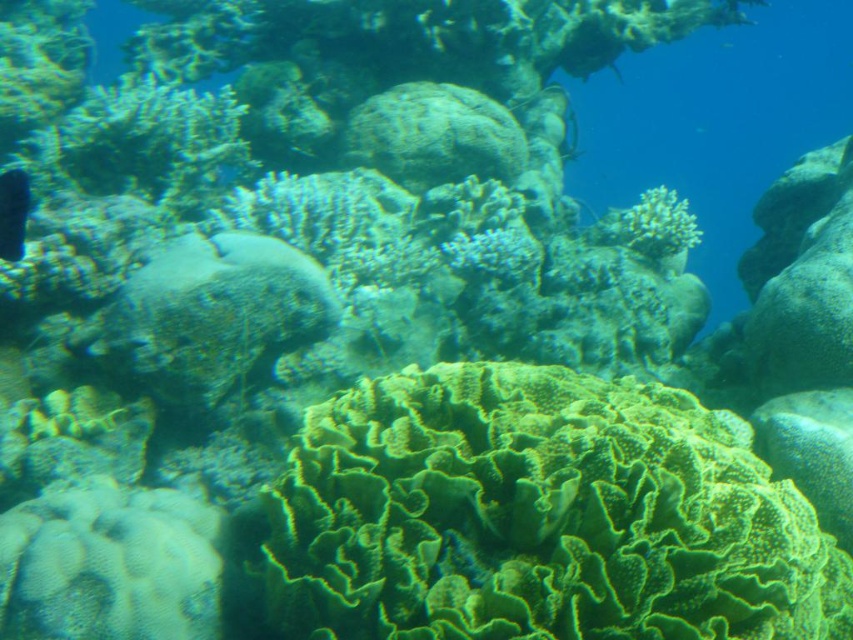
Can you confirm if green textured coral at center is positioned to the right of shiny black fish at left?

Correct, you'll find green textured coral at center to the right of shiny black fish at left.

Between green textured coral at center and shiny black fish at left, which one is positioned higher?

Positioned higher is shiny black fish at left.

The height and width of the screenshot is (640, 853). I want to click on green textured coral at center, so click(540, 516).